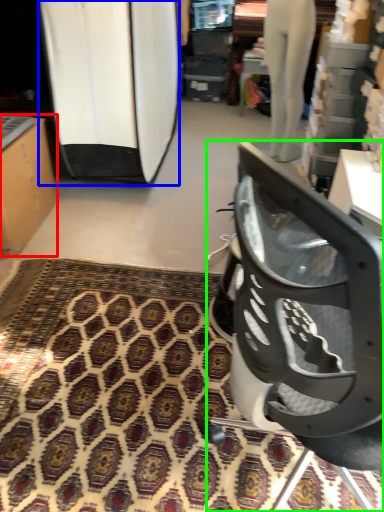
Question: Which object is the closest to the furniture (highlighted by a red box)? Choose among these: surfboard (highlighted by a blue box) or chair (highlighted by a green box).

Choices:
 (A) surfboard
 (B) chair

Answer: (A)